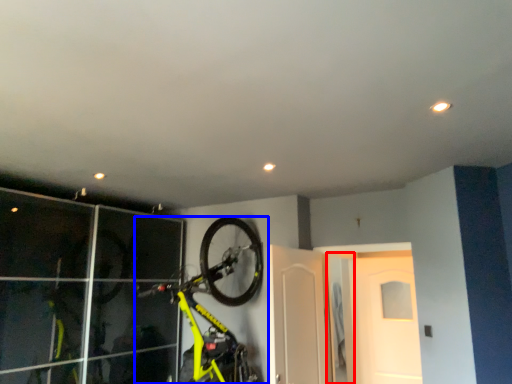
Question: Which of the following is the farthest to the observer, door (highlighted by a red box) or bicycle (highlighted by a blue box)?

Choices:
 (A) door
 (B) bicycle

Answer: (A)